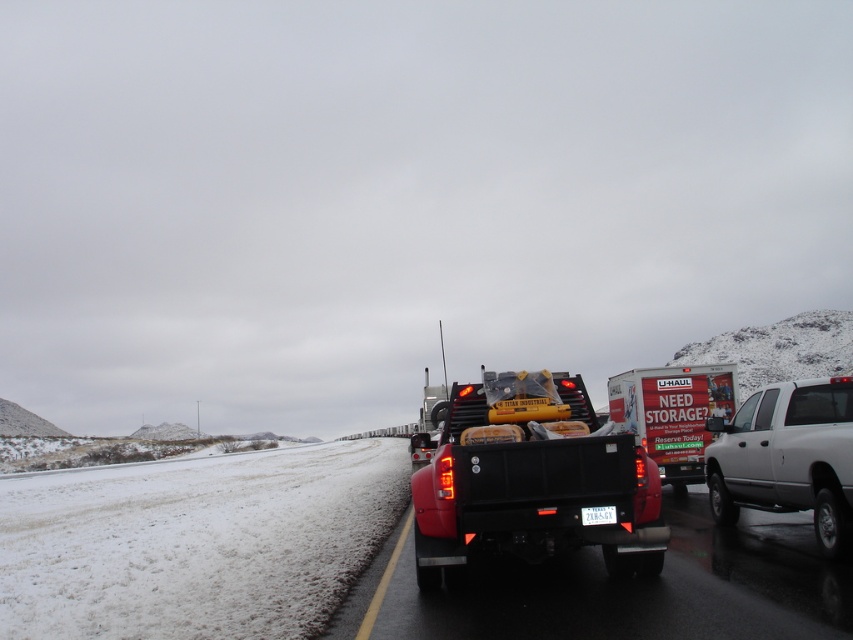
Is white matte u-haul trailer at center closer to the viewer compared to white plastic license plate at center?

No, it is behind white plastic license plate at center.

Is white matte u-haul trailer at center below white plastic license plate at center?

Indeed, white matte u-haul trailer at center is positioned under white plastic license plate at center.

You are a GUI agent. You are given a task and a screenshot of the screen. Output one action in this format:
    pyautogui.click(x=<x>, y=<y>)
    Task: Click on the white matte u-haul trailer at center
    Image resolution: width=853 pixels, height=640 pixels.
    Given the screenshot: What is the action you would take?
    pyautogui.click(x=672, y=413)

Can you confirm if white matte pickup truck at right is positioned to the left of white plastic license plate at center?

In fact, white matte pickup truck at right is to the right of white plastic license plate at center.

Can you confirm if white matte pickup truck at right is shorter than white plastic license plate at center?

Incorrect, white matte pickup truck at right's height does not fall short of white plastic license plate at center's.

Measure the distance between white matte pickup truck at right and camera.

white matte pickup truck at right is 6.91 meters from camera.

The width and height of the screenshot is (853, 640). What are the coordinates of `white matte pickup truck at right` in the screenshot? It's located at (787, 458).

Between matte black tow truck at center and white plastic license plate at center, which one is positioned lower?

white plastic license plate at center is below.

Can you confirm if matte black tow truck at center is positioned to the left of white plastic license plate at center?

Correct, you'll find matte black tow truck at center to the left of white plastic license plate at center.

Is point (479, 552) closer to viewer compared to point (598, 524)?

No.

Identify the location of matte black tow truck at center. This screenshot has width=853, height=640. (531, 483).